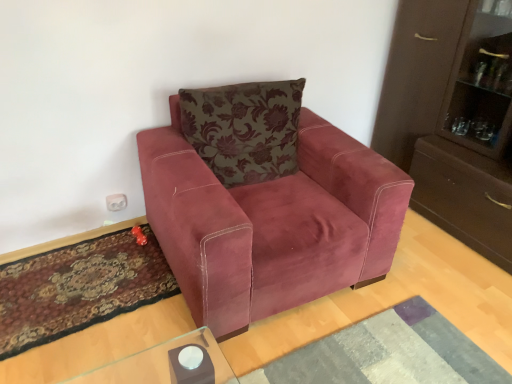
Locate an element on the screen. free point above carpeted rug at lower left, the 2th mat from the right (from a real-world perspective) is located at coordinates (81, 276).